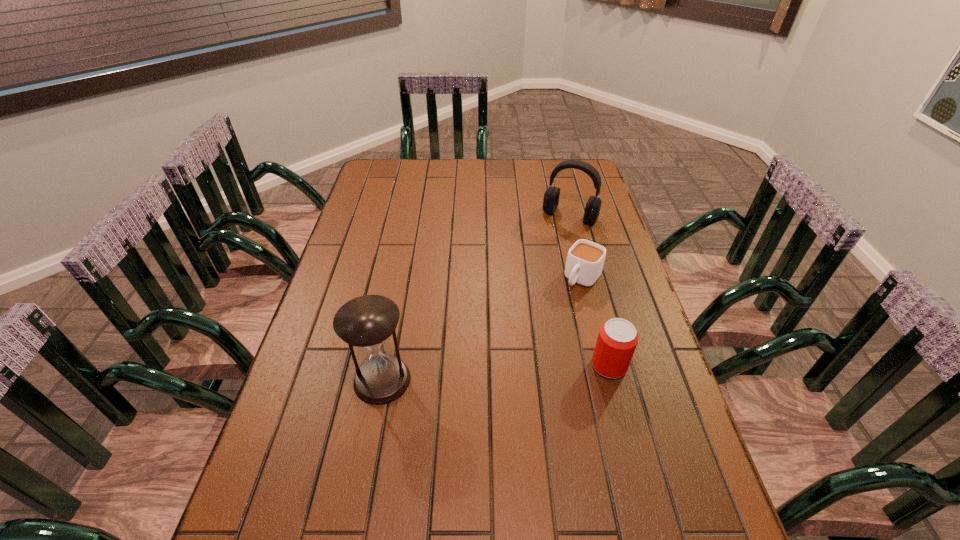
Image resolution: width=960 pixels, height=540 pixels. In order to click on free space located on the headband of the headset in this screenshot , I will do `click(538, 265)`.

The height and width of the screenshot is (540, 960). In order to click on blank space located 0.160m on the headband of the headset in this screenshot , I will do `click(544, 254)`.

Where is `free space located on the headband of the headset`? This screenshot has height=540, width=960. free space located on the headband of the headset is located at coordinates (x=540, y=261).

Where is `object at the left edge`? This screenshot has width=960, height=540. object at the left edge is located at coordinates (367, 322).

Find the location of a particular element. beer can that is at the right edge is located at coordinates (617, 339).

The height and width of the screenshot is (540, 960). What are the coordinates of `cup that is at the right edge` in the screenshot? It's located at (585, 259).

In order to click on headset located in the right edge section of the desktop in this screenshot , I will do `click(551, 197)`.

What are the coordinates of `free space at the far edge of the desktop` in the screenshot? It's located at (439, 179).

Locate an element on the screen. Image resolution: width=960 pixels, height=540 pixels. free space at the near edge is located at coordinates (473, 483).

Where is `vacant space at the left edge of the desktop`? Image resolution: width=960 pixels, height=540 pixels. vacant space at the left edge of the desktop is located at coordinates (343, 413).